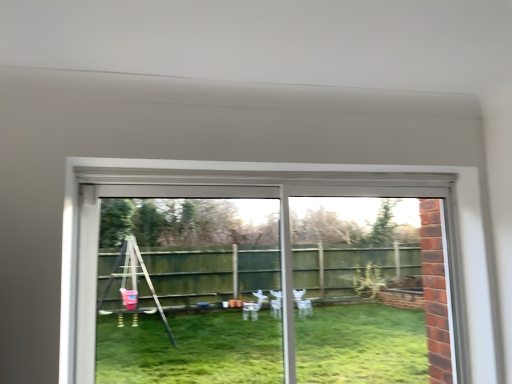
Find the location of `transparent glass window at center`. transparent glass window at center is located at coordinates (281, 227).

What is the approximate height of transparent glass window at center?

1.03 meters.

This screenshot has height=384, width=512. Describe the element at coordinates (281, 227) in the screenshot. I see `transparent glass window at center` at that location.

This screenshot has width=512, height=384. Identify the location of transparent glass window at center. (281, 227).